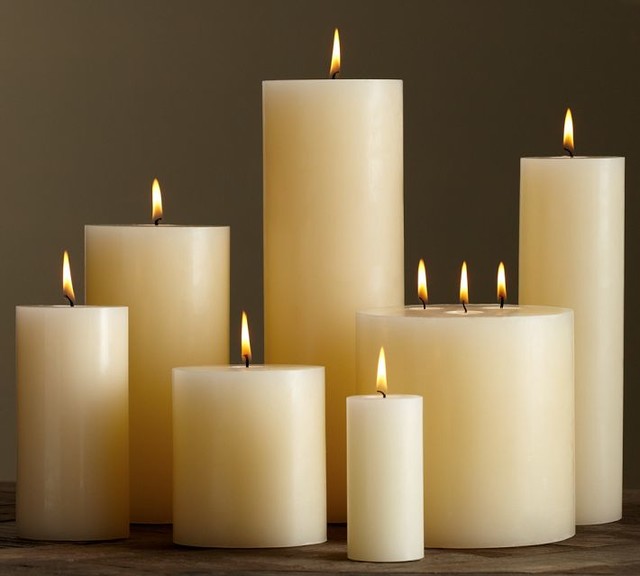
You are a GUI agent. You are given a task and a screenshot of the screen. Output one action in this format:
    pyautogui.click(x=<x>, y=<y>)
    Task: Click on the candles
    This screenshot has height=576, width=640.
    Given the screenshot: What is the action you would take?
    pyautogui.click(x=63, y=394), pyautogui.click(x=173, y=272), pyautogui.click(x=234, y=434), pyautogui.click(x=315, y=226), pyautogui.click(x=506, y=394), pyautogui.click(x=381, y=481), pyautogui.click(x=571, y=255)